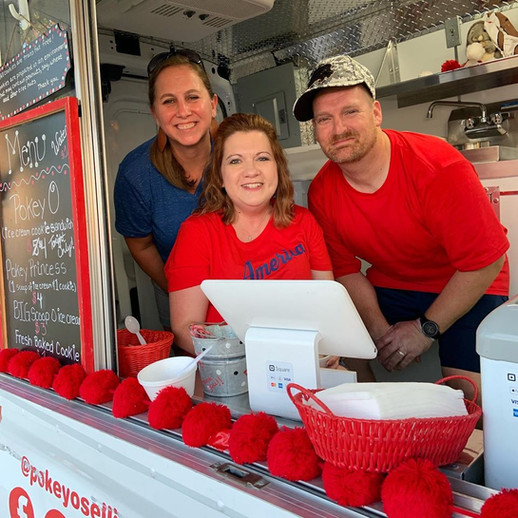
Locate an element on the screen. This screenshot has width=518, height=518. styrofoam bowl is located at coordinates (158, 370).